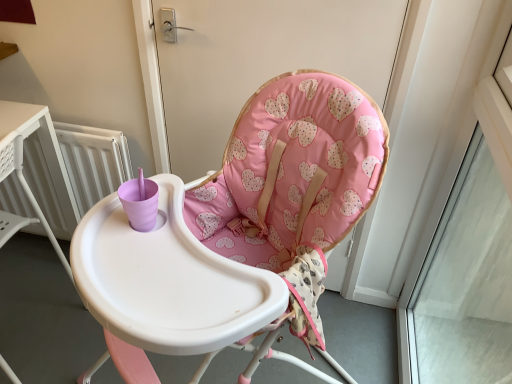
Question: From a real-world perspective, is pink fabric highchair at center positioned above or below transparent glass window at upper right?

Choices:
 (A) below
 (B) above

Answer: (A)

Question: Is pink fabric highchair at center in front of or behind transparent glass window at upper right in the image?

Choices:
 (A) behind
 (B) front

Answer: (B)

Question: Considering the real-world distances, which object is farthest from the transparent glass window at upper right?

Choices:
 (A) pink fabric highchair at center
 (B) white radiator at left
 (C) pink fabric cushion at center

Answer: (B)

Question: Considering the real-world distances, which object is farthest from the transparent glass window at upper right?

Choices:
 (A) pink fabric highchair at center
 (B) pink fabric cushion at center
 (C) white radiator at left

Answer: (C)